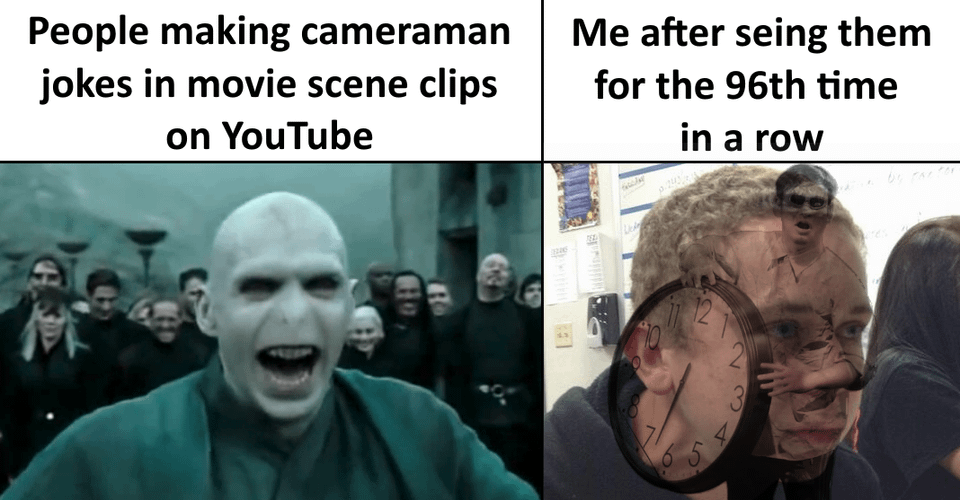
At what (x,y) coordinates should I click in order to perform the action: click on poster. Please return your answer as a coordinate pair (x, y). The image size is (960, 500). Looking at the image, I should click on (635, 187), (588, 191), (561, 327).